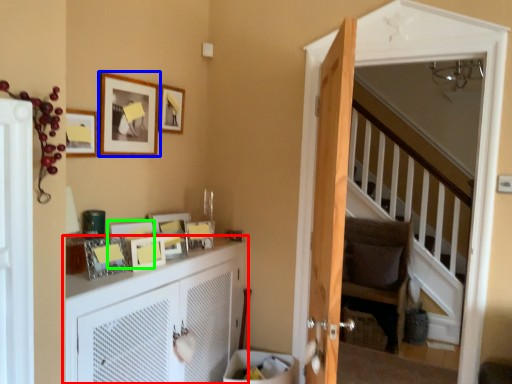
Question: Estimate the real-world distances between objects in this image. Which object is closer to cabinetry (highlighted by a red box), picture frame (highlighted by a blue box) or picture frame (highlighted by a green box)?

Choices:
 (A) picture frame
 (B) picture frame

Answer: (B)